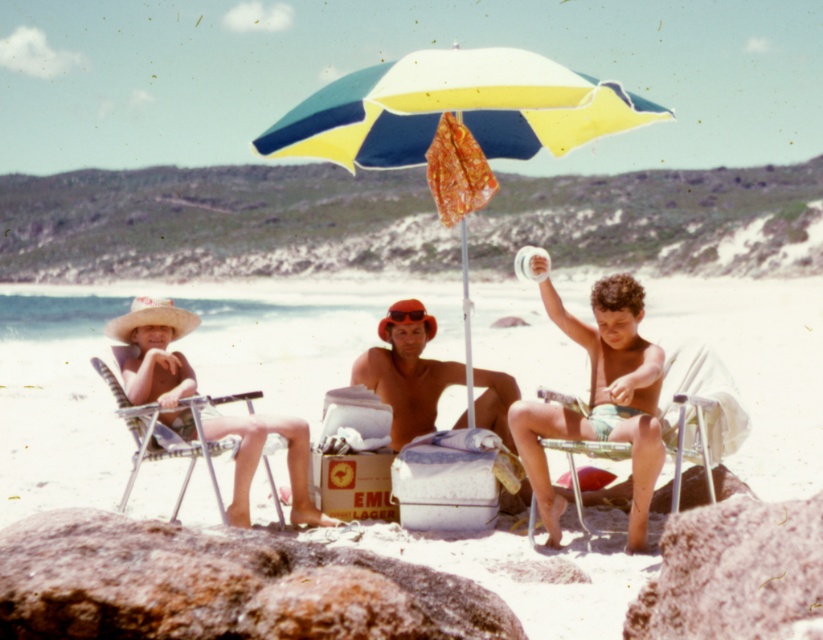
Question: Is white sand beach at center above metallic silver beach chair at left?

Choices:
 (A) no
 (B) yes

Answer: (B)

Question: Does white sand beach at center come behind metallic silver beach chair at left?

Choices:
 (A) no
 (B) yes

Answer: (A)

Question: Which point is closer to the camera taking this photo?

Choices:
 (A) (412, 144)
 (B) (742, 369)
 (C) (608, 422)

Answer: (C)

Question: Estimate the real-world distances between objects in this image. Which object is closer to the metallic silver beach chair at right?

Choices:
 (A) matte green shorts at center
 (B) white sand beach at center

Answer: (A)

Question: Which point is closer to the camera?

Choices:
 (A) white sand beach at center
 (B) yellow and blue fabric umbrella at center
 (C) matte green shorts at center

Answer: (A)

Question: Can you confirm if brown leather hat at center is smaller than metallic silver beach chair at left?

Choices:
 (A) yes
 (B) no

Answer: (A)